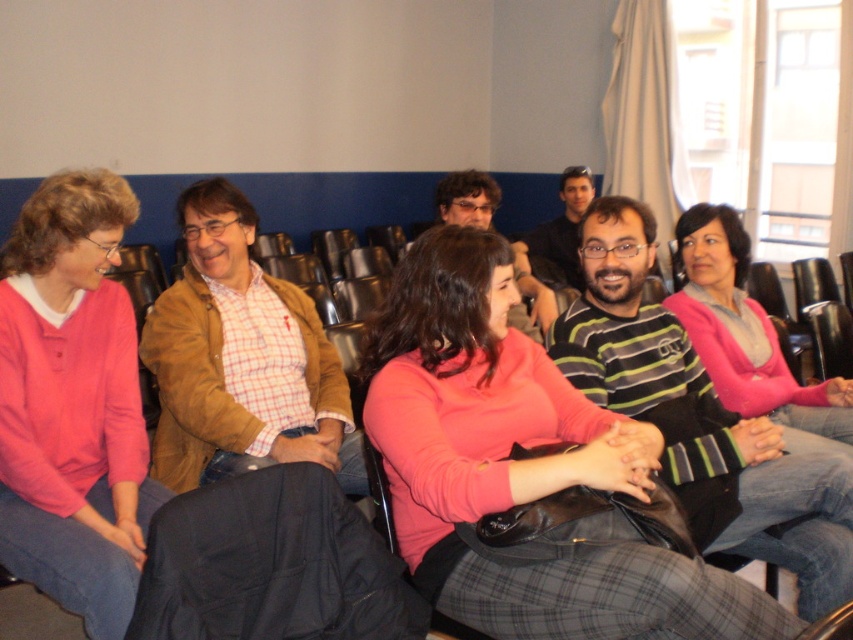
Which is below, pink sweater at left or brown leather jacket at center?

pink sweater at left

Does point (38, 218) come closer to viewer compared to point (165, 372)?

That is True.

Identify the location of pink sweater at left. (73, 403).

Does point (309, 412) lie behind point (277, 608)?

That is True.

Can you confirm if brown leather jacket at center is positioned above black fabric jacket at lower center?

Indeed, brown leather jacket at center is positioned over black fabric jacket at lower center.

Which is behind, point (219, 212) or point (285, 566)?

Point (219, 212)

This screenshot has height=640, width=853. Identify the location of brown leather jacket at center. (241, 358).

Consider the image. Between brown leather jacket at center and matte black shirt at center, which one has less height?

matte black shirt at center

Who is more forward, (202, 355) or (570, 180)?

Point (202, 355)

You are a GUI agent. You are given a task and a screenshot of the screen. Output one action in this format:
    pyautogui.click(x=<x>, y=<y>)
    Task: Click on the brown leather jacket at center
    This screenshot has height=640, width=853.
    Given the screenshot: What is the action you would take?
    pyautogui.click(x=241, y=358)